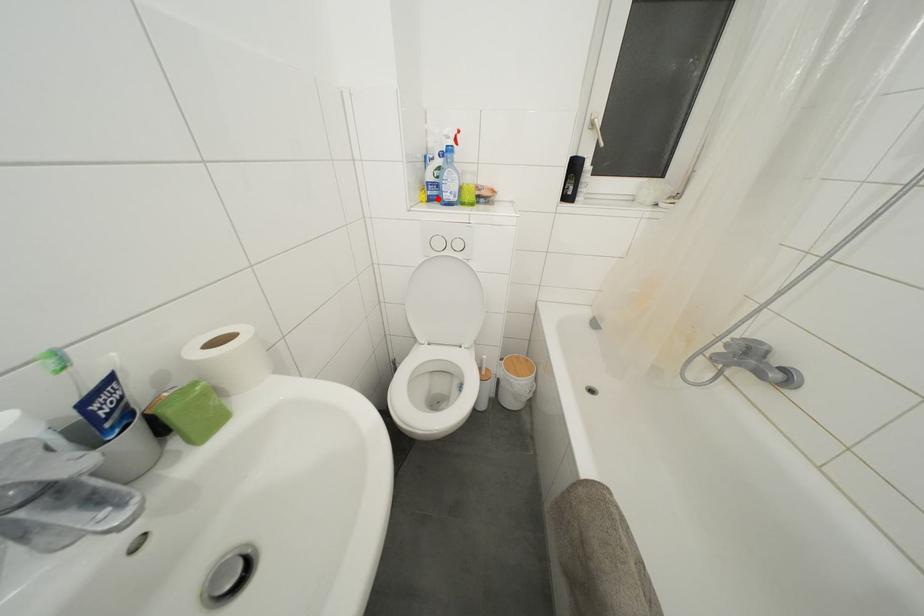
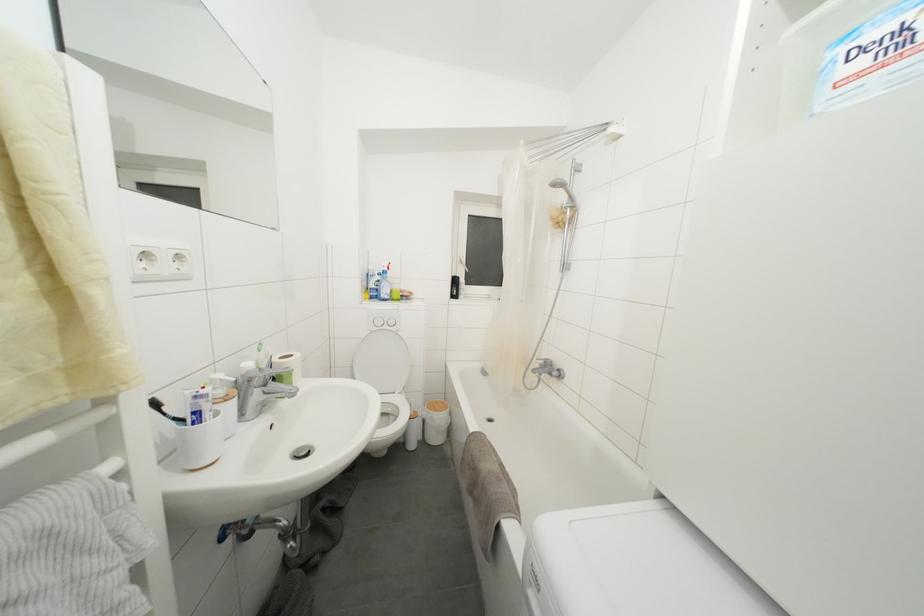
The point at the highlighted location is marked in the first image. Where is the corresponding point in the second image?

(379, 300)